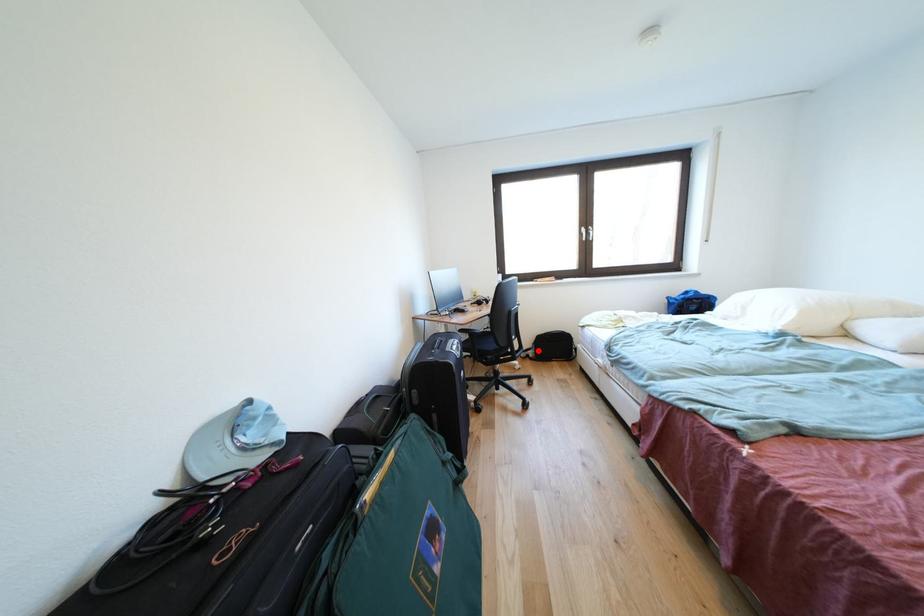
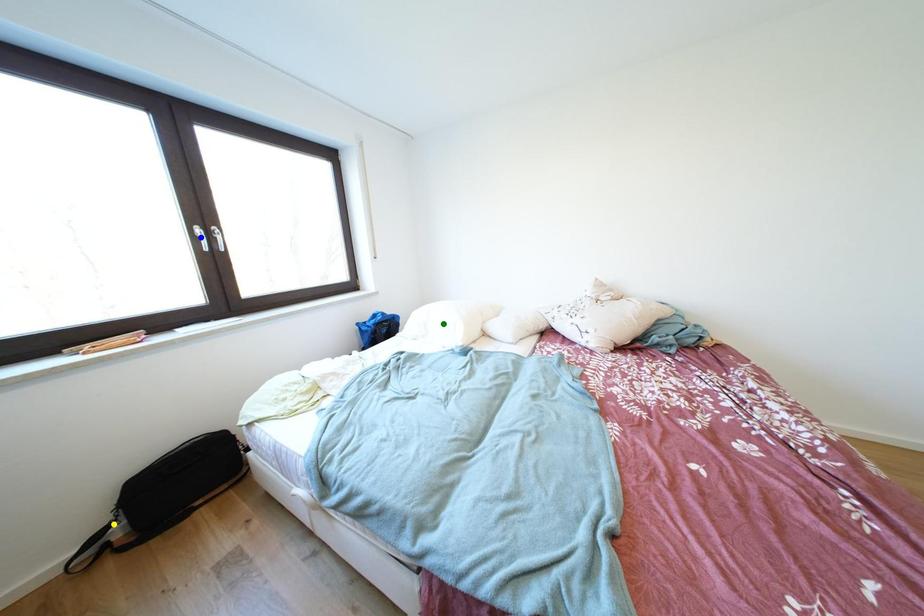
Question: I am providing you with two images of the same scene from different viewpoints. A red point is marked on the first image. You are given multiple points on the second image. Which point in image 2 represents the same 3d spot as the red point in image 1?

Choices:
 (A) green point
 (B) yellow point
 (C) blue point

Answer: (B)